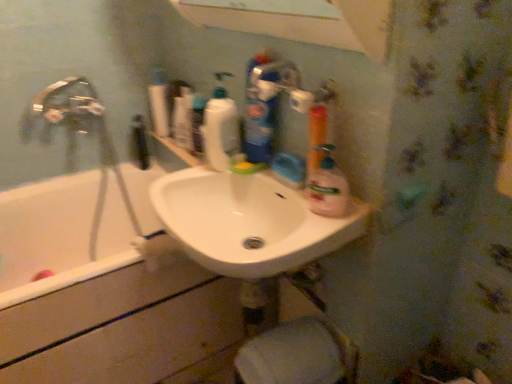
Question: From the image's perspective, does white matte toilet paper at lower center appear higher than translucent plastic bottle at upper center, arranged as the 3th cleaning product when viewed from the front?

Choices:
 (A) no
 (B) yes

Answer: (A)

Question: Are white matte toilet paper at lower center and translucent plastic bottle at upper center, marked as the 2th cleaning product in a back-to-front arrangement, located far from each other?

Choices:
 (A) yes
 (B) no

Answer: (B)

Question: Can you confirm if white matte toilet paper at lower center is positioned to the left of translucent plastic bottle at upper center, marked as the 2th cleaning product in a back-to-front arrangement?

Choices:
 (A) yes
 (B) no

Answer: (B)

Question: Considering the relative sizes of white matte toilet paper at lower center and translucent plastic bottle at upper center, positioned as the 2th cleaning product in left-to-right order, in the image provided, is white matte toilet paper at lower center shorter than translucent plastic bottle at upper center, positioned as the 2th cleaning product in left-to-right order,?

Choices:
 (A) no
 (B) yes

Answer: (A)

Question: Is white matte toilet paper at lower center touching translucent plastic bottle at upper center, marked as the 2th cleaning product in a back-to-front arrangement?

Choices:
 (A) yes
 (B) no

Answer: (B)

Question: Does white matte toilet paper at lower center have a lesser width compared to translucent plastic bottle at upper center, arranged as the 3th cleaning product when viewed from the front?

Choices:
 (A) yes
 (B) no

Answer: (B)

Question: From the image's perspective, is translucent plastic spray bottle at center, which is counted as the 1th cleaning product, starting from the front, under white matte toilet paper at lower center?

Choices:
 (A) yes
 (B) no

Answer: (B)

Question: Considering the relative sizes of translucent plastic spray bottle at center, the fourth cleaning product when ordered from left to right, and white matte toilet paper at lower center in the image provided, is translucent plastic spray bottle at center, the fourth cleaning product when ordered from left to right, wider than white matte toilet paper at lower center?

Choices:
 (A) yes
 (B) no

Answer: (B)

Question: Is translucent plastic spray bottle at center, acting as the fourth cleaning product starting from the back, turned away from white matte toilet paper at lower center?

Choices:
 (A) yes
 (B) no

Answer: (B)

Question: Is white matte toilet paper at lower center a part of translucent plastic spray bottle at center, the fourth cleaning product when ordered from left to right?

Choices:
 (A) no
 (B) yes

Answer: (A)

Question: Is translucent plastic spray bottle at center, which is the first cleaning product in right-to-left order, shorter than white matte toilet paper at lower center?

Choices:
 (A) no
 (B) yes

Answer: (B)

Question: Is the depth of translucent plastic spray bottle at center, which is counted as the 1th cleaning product, starting from the front, greater than that of white matte toilet paper at lower center?

Choices:
 (A) no
 (B) yes

Answer: (A)

Question: From a real-world perspective, is translucent plastic spray bottle at center, the fourth cleaning product when ordered from left to right, over translucent plastic bottle at upper center, positioned as the 2th cleaning product in left-to-right order?

Choices:
 (A) yes
 (B) no

Answer: (B)